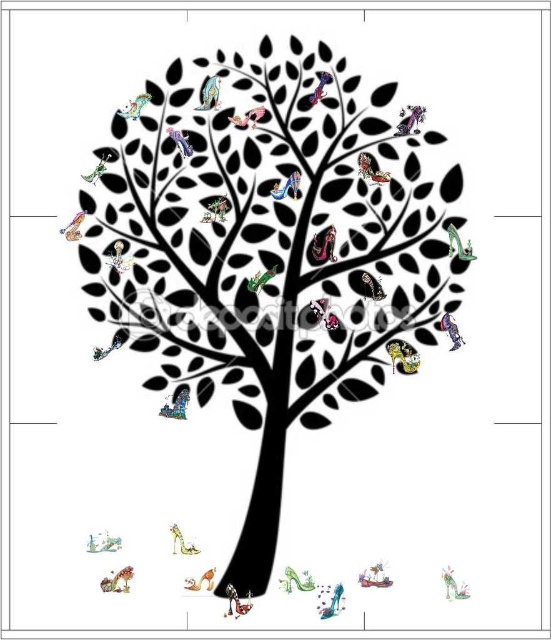
Does multicolored feathers at lower left appear on the left side of metallic pink bird at upper center?

A: Indeed, multicolored feathers at lower left is positioned on the left side of metallic pink bird at upper center.

Which is behind, point (116, 572) or point (244, 116)?

Point (244, 116)

The image size is (551, 640). What are the coordinates of `multicolored feathers at lower left` in the screenshot? It's located at (117, 580).

Looking at this image, between black matte tree at center and metallic blue bird at upper left, which one is positioned higher?

Positioned higher is metallic blue bird at upper left.

Does black matte tree at center appear on the left side of metallic blue bird at upper left?

No, black matte tree at center is not to the left of metallic blue bird at upper left.

Where is `black matte tree at center`? This screenshot has width=551, height=640. black matte tree at center is located at coordinates (272, 256).

Can you confirm if shiny metallic shoe at lower right is wider than matte yellow bird at lower center?

In fact, shiny metallic shoe at lower right might be narrower than matte yellow bird at lower center.

Which is above, shiny metallic shoe at lower right or matte yellow bird at lower center?

Positioned higher is matte yellow bird at lower center.

Describe the element at coordinates (453, 586) in the screenshot. The image size is (551, 640). I see `shiny metallic shoe at lower right` at that location.

Locate an element on the screen. The image size is (551, 640). shiny metallic shoe at lower right is located at coordinates (453, 586).